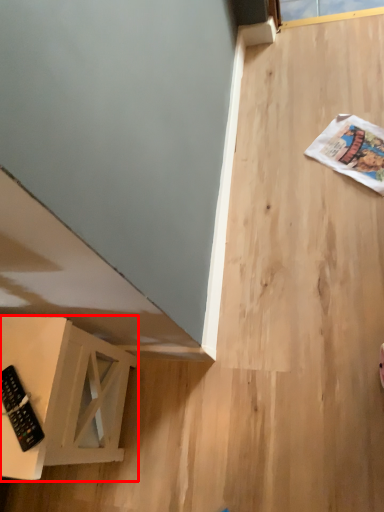
Question: Observing the image, what is the correct spatial positioning of furniture (annotated by the red box) in reference to control?

Choices:
 (A) right
 (B) left

Answer: (B)